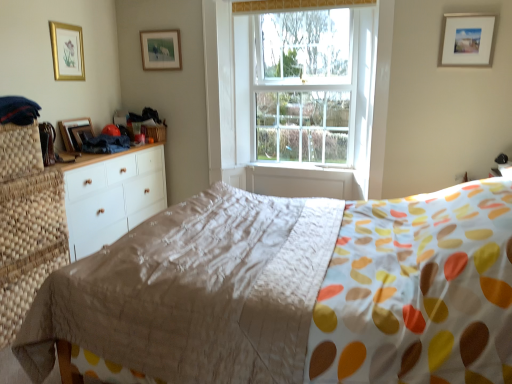
Question: Does clear glass window at center have a lesser height compared to white painted wood at center?

Choices:
 (A) no
 (B) yes

Answer: (A)

Question: Does clear glass window at center lie in front of white painted wood at center?

Choices:
 (A) yes
 (B) no

Answer: (A)

Question: Is white painted wood at center at the back of clear glass window at center?

Choices:
 (A) yes
 (B) no

Answer: (B)

Question: Is clear glass window at center positioned far away from white painted wood at center?

Choices:
 (A) no
 (B) yes

Answer: (A)

Question: Is clear glass window at center smaller than white painted wood at center?

Choices:
 (A) yes
 (B) no

Answer: (B)

Question: Is clear glass window at center outside white painted wood at center?

Choices:
 (A) yes
 (B) no

Answer: (A)

Question: Can you confirm if white matte picture frame at upper right, placed as the fourth picture frame when sorted from left to right, is wider than matte beige quilt at center?

Choices:
 (A) no
 (B) yes

Answer: (A)

Question: Is white matte picture frame at upper right, placed as the fourth picture frame when sorted from left to right, taller than matte beige quilt at center?

Choices:
 (A) no
 (B) yes

Answer: (A)

Question: Is white matte picture frame at upper right, the first picture frame positioned from the right, far from matte beige quilt at center?

Choices:
 (A) no
 (B) yes

Answer: (B)

Question: Considering the relative sizes of white matte picture frame at upper right, placed as the fourth picture frame when sorted from left to right, and matte beige quilt at center in the image provided, is white matte picture frame at upper right, placed as the fourth picture frame when sorted from left to right, bigger than matte beige quilt at center?

Choices:
 (A) yes
 (B) no

Answer: (B)

Question: From the image's perspective, is white matte picture frame at upper right, the first picture frame positioned from the right, over matte beige quilt at center?

Choices:
 (A) yes
 (B) no

Answer: (A)

Question: Is the depth of white matte picture frame at upper right, the first picture frame positioned from the right, less than that of matte beige quilt at center?

Choices:
 (A) yes
 (B) no

Answer: (B)

Question: Does clear glass window at center have a greater height compared to white matte picture frame at upper right, the first picture frame positioned from the right?

Choices:
 (A) yes
 (B) no

Answer: (A)